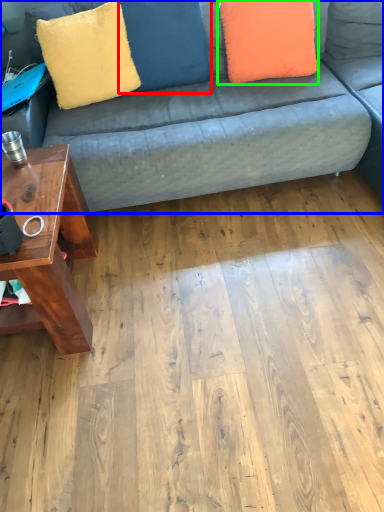
Question: Considering the real-world distances, which object is farthest from pillow (highlighted by a red box)? studio couch (highlighted by a blue box) or pillow (highlighted by a green box)?

Choices:
 (A) studio couch
 (B) pillow

Answer: (A)